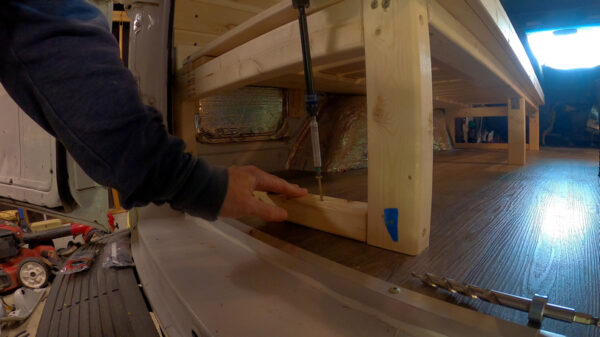
At what (x,y) coordinates should I click in order to perform the action: click on bench. Please return your answer as a coordinate pair (x, y). Looking at the image, I should click on (422, 59).